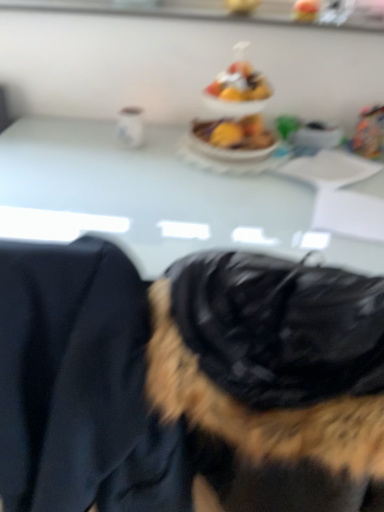
Image resolution: width=384 pixels, height=512 pixels. I want to click on vacant region above white glossy table at center (from a real-world perspective), so click(164, 178).